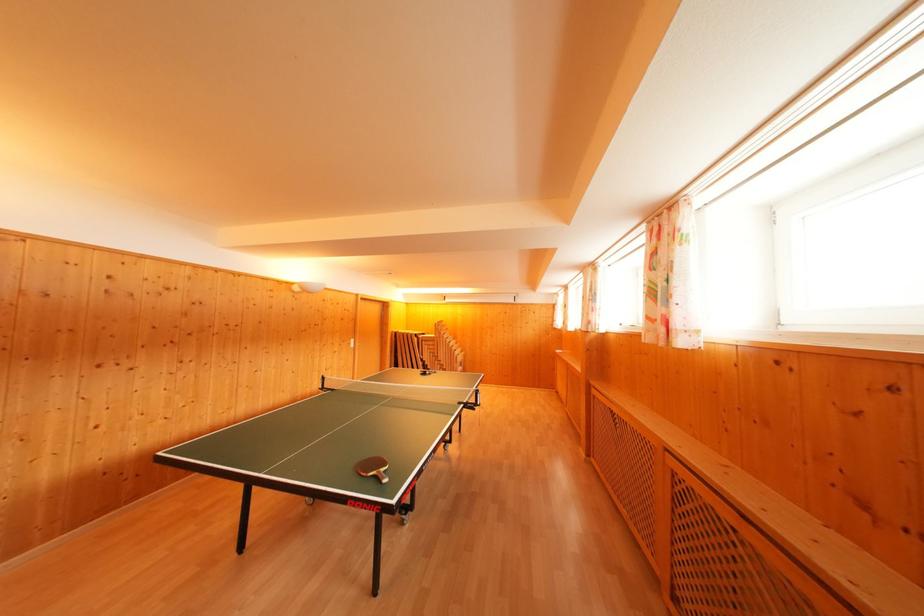
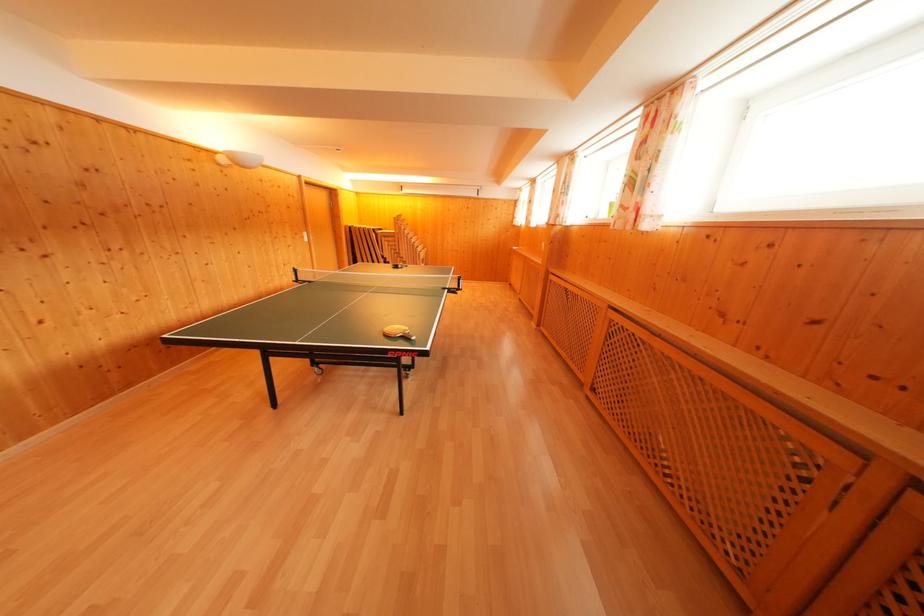
Question: What movement of the cameraman would produce the second image?

Choices:
 (A) Left
 (B) Right
 (C) Forward
 (D) Backward

Answer: (A)